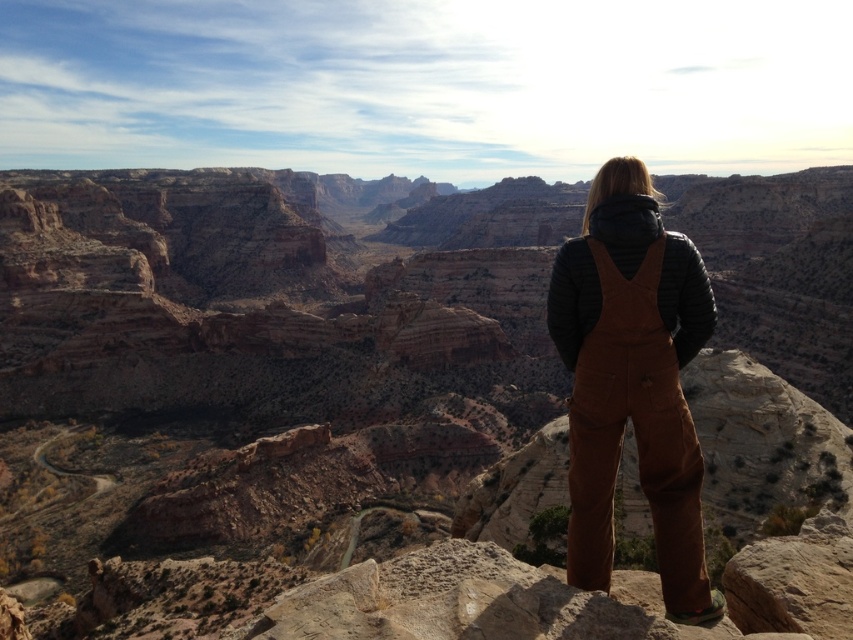
You are standing at the edge of the canyon and want to take a photo that includes both the person and a distant landmark. The person is at point (33, 340), and the landmark is at point (704, 564). Which point is closer to you, the photographer?

Point (33, 340) is closer to you than point (704, 564) because it is further to the camera, meaning it appears nearer in the image.

You are a hiker who wants to cross the brown rock canyon at center. You have a rope that is exactly the same length as the brown cotton overalls at center. Will the rope be long enough to cross the canyon?

The brown rock canyon at center is wider than the brown cotton overalls at center, so the rope, which is the same length as the overalls, will not be long enough to cross the canyon.